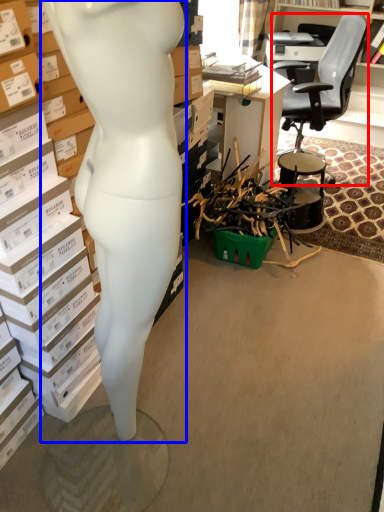
Question: Among these objects, which one is nearest to the camera, chair (highlighted by a red box) or person (highlighted by a blue box)?

Choices:
 (A) chair
 (B) person

Answer: (B)